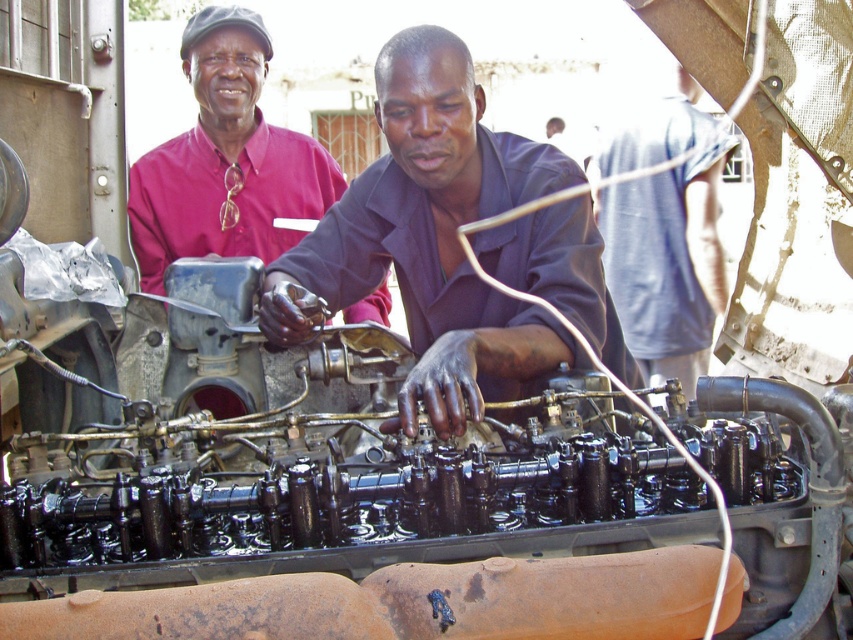
Question: Which object is the closest to the matte black shirt at center?

Choices:
 (A) matte pink shirt at upper left
 (B) gray fabric shirt at center

Answer: (A)

Question: Is matte black shirt at center further to camera compared to matte pink shirt at upper left?

Choices:
 (A) no
 (B) yes

Answer: (A)

Question: Can you confirm if matte black shirt at center is positioned to the left of matte pink shirt at upper left?

Choices:
 (A) yes
 (B) no

Answer: (B)

Question: Among these objects, which one is farthest from the camera?

Choices:
 (A) matte pink shirt at upper left
 (B) gray fabric shirt at center
 (C) matte black shirt at center

Answer: (B)

Question: Which is farther from the matte pink shirt at upper left?

Choices:
 (A) matte black shirt at center
 (B) gray fabric shirt at center

Answer: (B)

Question: In this image, where is matte pink shirt at upper left located relative to gray fabric shirt at center?

Choices:
 (A) below
 (B) above

Answer: (A)